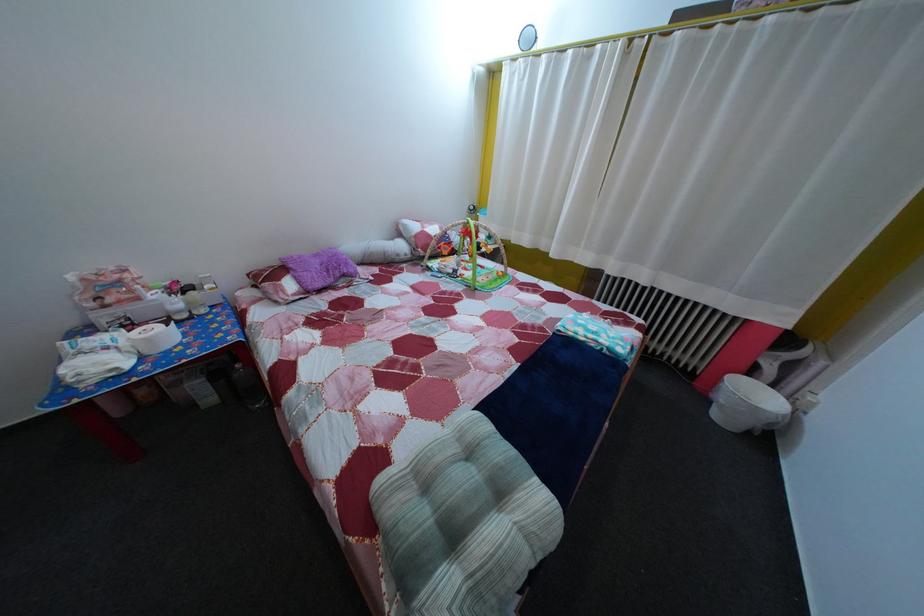
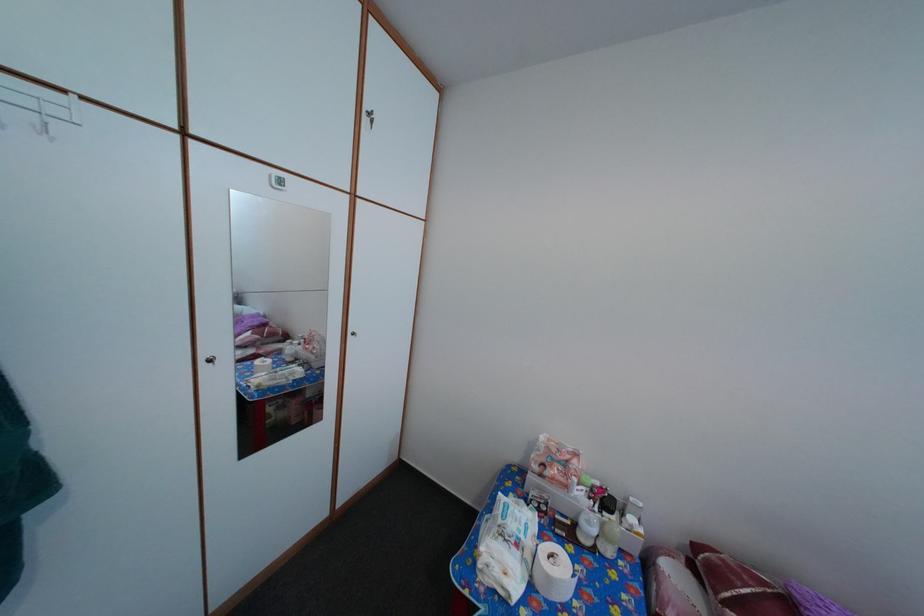
Locate, in the second image, the point that corresponds to point 157,347 in the first image.

(558, 586)